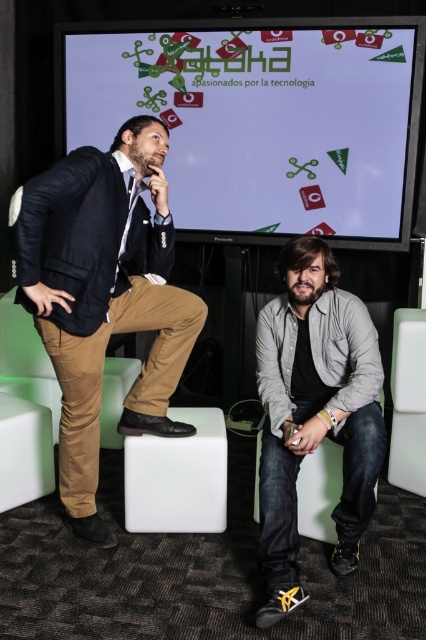
Question: Which of the following is the closest to the observer?

Choices:
 (A) (402, 33)
 (B) (92, 372)
 (C) (345, 392)
 (D) (201, 486)

Answer: (B)

Question: Is gray cotton shirt at lower right above white plastic stool at lower center?

Choices:
 (A) yes
 (B) no

Answer: (A)

Question: Does dark blue suit at left appear on the left side of white plastic stool at lower center?

Choices:
 (A) yes
 (B) no

Answer: (A)

Question: Which object appears farthest from the camera in this image?

Choices:
 (A) white glossy screen at upper center
 (B) dark blue suit at left
 (C) white plastic stool at lower center
 (D) gray cotton shirt at lower right

Answer: (A)

Question: Estimate the real-world distances between objects in this image. Which object is closer to the white glossy screen at upper center?

Choices:
 (A) gray cotton shirt at lower right
 (B) white plastic stool at lower center

Answer: (A)

Question: Can you confirm if white glossy screen at upper center is bigger than gray cotton shirt at lower right?

Choices:
 (A) no
 (B) yes

Answer: (B)